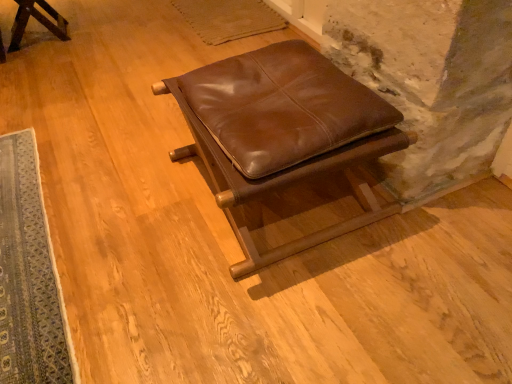
Where is `vacant region under matte brown leather stool at upper left, placed as the 2th furniture when sorted from right to left (from a real-world perspective)`? The width and height of the screenshot is (512, 384). vacant region under matte brown leather stool at upper left, placed as the 2th furniture when sorted from right to left (from a real-world perspective) is located at coordinates (42, 41).